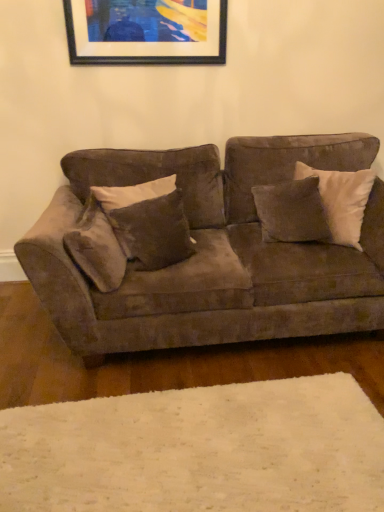
Question: In terms of size, does velvet brown pillow at center, positioned as the second pillow in right-to-left order, appear bigger or smaller than suede couch at center?

Choices:
 (A) big
 (B) small

Answer: (B)

Question: Considering their positions, is velvet brown pillow at center, positioned as the second pillow in right-to-left order, located in front of or behind suede couch at center?

Choices:
 (A) behind
 (B) front

Answer: (A)

Question: Based on their relative distances, which object is nearer to the velvet brown pillow at center, which is the 2th pillow in left-to-right order?

Choices:
 (A) black matte picture frame at upper center
 (B) white soft rug at lower center
 (C) suede-like brown pillow at left, positioned as the first pillow in left-to-right order
 (D) suede couch at center
 (E) suede-like brown pillow at center, arranged as the first pillow when viewed from the right

Answer: (C)

Question: Based on their relative distances, which object is farther from the suede-like brown pillow at center, arranged as the first pillow when viewed from the right?

Choices:
 (A) velvet brown pillow at center, positioned as the second pillow in right-to-left order
 (B) suede-like brown pillow at left, positioned as the first pillow in left-to-right order
 (C) suede couch at center
 (D) black matte picture frame at upper center
 (E) white soft rug at lower center

Answer: (E)